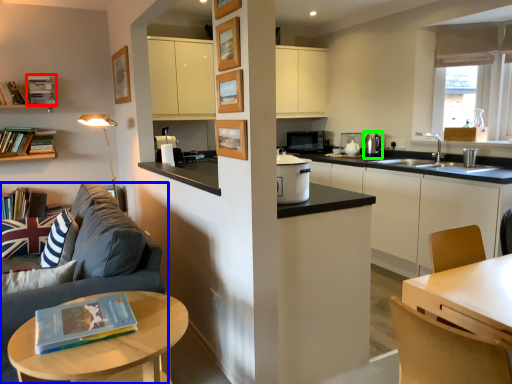
Question: Estimate the real-world distances between objects in this image. Which object is farther from book (highlighted by a red box), studio couch (highlighted by a blue box) or appliance (highlighted by a green box)?

Choices:
 (A) studio couch
 (B) appliance

Answer: (B)